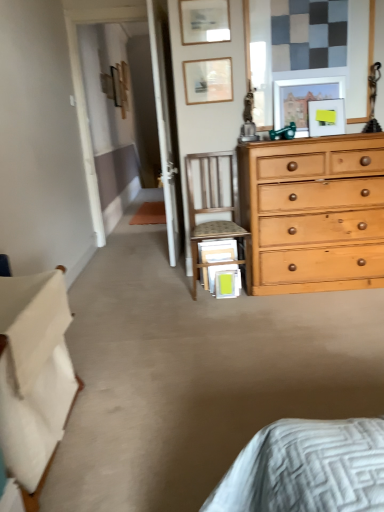
Question: From a real-world perspective, is yellow matte picture frame at upper center, placed as the second picture frame when sorted from front to back, physically above wooden picture frame at upper center, the 4th picture frame in the front-to-back sequence?

Choices:
 (A) no
 (B) yes

Answer: (A)

Question: Is yellow matte picture frame at upper center, which is counted as the 5th picture frame, starting from the top, facing towards wooden picture frame at upper center, the 2th picture frame in the back-to-front sequence?

Choices:
 (A) no
 (B) yes

Answer: (A)

Question: From the image's perspective, is yellow matte picture frame at upper center, placed as the second picture frame when sorted from front to back, located above wooden picture frame at upper center, the 2th picture frame in the back-to-front sequence?

Choices:
 (A) yes
 (B) no

Answer: (B)

Question: Is yellow matte picture frame at upper center, placed as the second picture frame when sorted from front to back, turned away from wooden picture frame at upper center, the 3th picture frame positioned from the bottom?

Choices:
 (A) no
 (B) yes

Answer: (A)

Question: Is the surface of yellow matte picture frame at upper center, acting as the fourth picture frame starting from the back, in direct contact with wooden picture frame at upper center, the 4th picture frame in the front-to-back sequence?

Choices:
 (A) yes
 (B) no

Answer: (B)

Question: Do you think white fabric bed at lower left is within wooden picture frame at upper center, the 4th picture frame in the front-to-back sequence, or outside of it?

Choices:
 (A) inside
 (B) outside

Answer: (B)

Question: From a real-world perspective, relative to wooden picture frame at upper center, which is the 3th picture frame from left to right, is white fabric bed at lower left vertically above or below?

Choices:
 (A) below
 (B) above

Answer: (A)

Question: Considering the positions of white fabric bed at lower left and wooden picture frame at upper center, which is the 3th picture frame from left to right, in the image, is white fabric bed at lower left taller or shorter than wooden picture frame at upper center, which is the 3th picture frame from left to right,?

Choices:
 (A) tall
 (B) short

Answer: (A)

Question: Based on their sizes in the image, would you say white fabric bed at lower left is bigger or smaller than wooden picture frame at upper center, which is the 3th picture frame from right to left?

Choices:
 (A) big
 (B) small

Answer: (A)

Question: Does point (193, 71) appear closer or farther from the camera than point (274, 100)?

Choices:
 (A) farther
 (B) closer

Answer: (B)

Question: From the image's perspective, relative to matte wooden picture frame at upper right, marked as the third picture frame in a front-to-back arrangement, is wooden picture frame at upper center, the 2th picture frame in the back-to-front sequence, above or below?

Choices:
 (A) above
 (B) below

Answer: (A)

Question: Is wooden picture frame at upper center, the 3th picture frame positioned from the bottom, situated inside matte wooden picture frame at upper right, acting as the fourth picture frame starting from the left, or outside?

Choices:
 (A) outside
 (B) inside

Answer: (A)

Question: From their relative heights in the image, would you say wooden picture frame at upper center, which is the 3th picture frame from left to right, is taller or shorter than matte wooden picture frame at upper right, the second picture frame from the right?

Choices:
 (A) short
 (B) tall

Answer: (A)

Question: Is matte wooden picture frame at upper center, positioned as the 2th picture frame in top-to-bottom order, inside or outside of wooden chair at center?

Choices:
 (A) outside
 (B) inside

Answer: (A)

Question: Is matte wooden picture frame at upper center, marked as the 4th picture frame in a bottom-to-top arrangement, wider or thinner than wooden chair at center?

Choices:
 (A) thin
 (B) wide

Answer: (A)